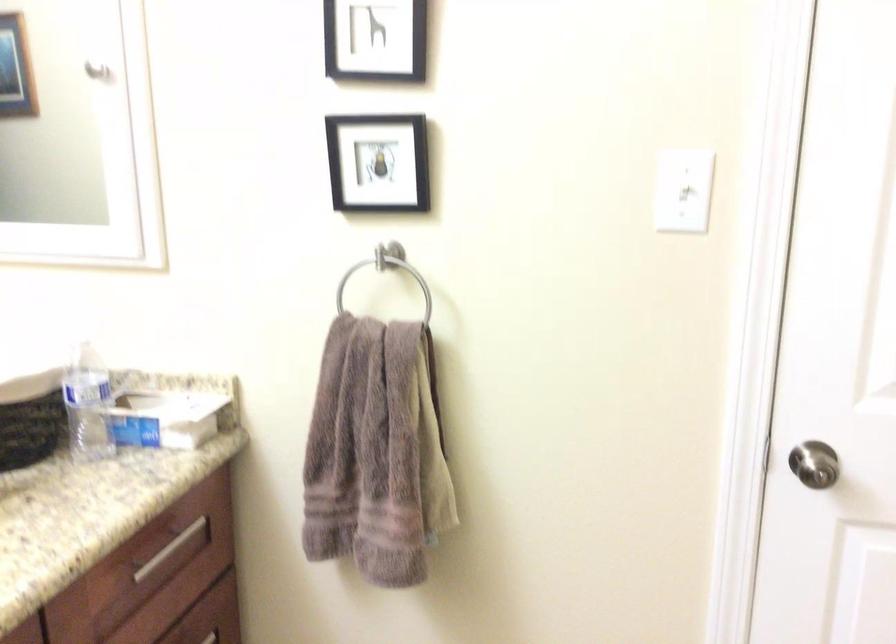
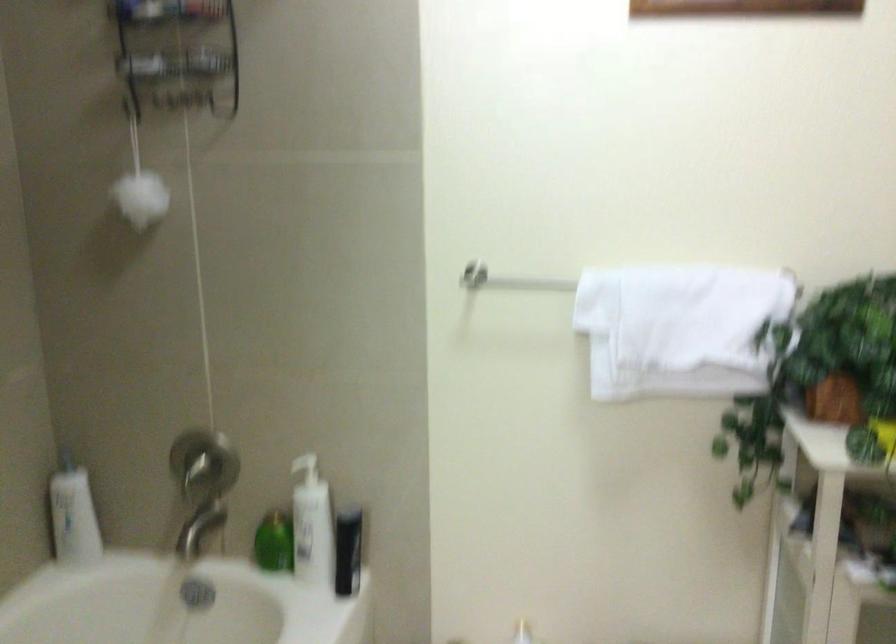
Question: The camera is either moving clockwise (left) or counter-clockwise (right) around the object. The first image is from the beginning of the video and the second image is from the end. Is the camera moving left or right when shooting the video?

Choices:
 (A) Left
 (B) Right

Answer: (A)